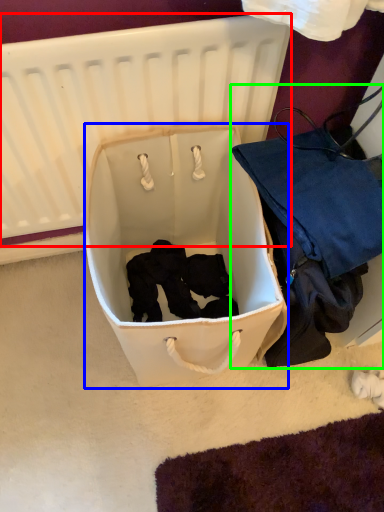
Question: Considering the real-world distances, which object is farthest from infant bed (highlighted by a red box)? storage box (highlighted by a blue box) or luggage and bags (highlighted by a green box)?

Choices:
 (A) storage box
 (B) luggage and bags

Answer: (B)